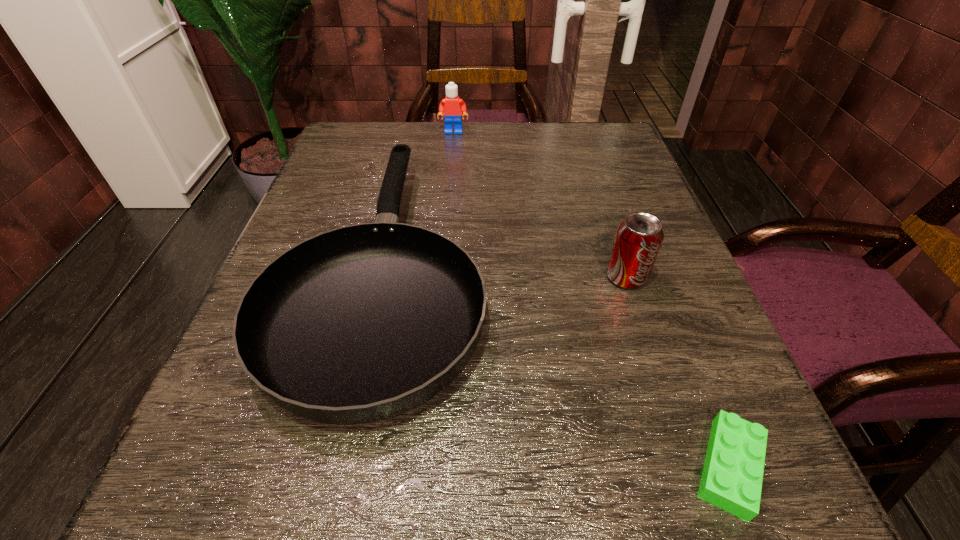
Where is `the taller Lego`? This screenshot has height=540, width=960. the taller Lego is located at coordinates (452, 106).

I want to click on the farther Lego, so click(452, 106).

The image size is (960, 540). Find the location of `soda can`. soda can is located at coordinates (638, 239).

At what (x,y) coordinates should I click in order to perform the action: click on the second shortest object. Please return your answer as a coordinate pair (x, y). Looking at the image, I should click on (365, 322).

This screenshot has width=960, height=540. I want to click on the shortest object, so click(x=732, y=475).

This screenshot has height=540, width=960. In order to click on the nearer Lego in this screenshot , I will do `click(732, 475)`.

This screenshot has width=960, height=540. What are the coordinates of `vacant space located 0.360m on the face of the left Lego` in the screenshot? It's located at (445, 228).

I want to click on vacant area situated 0.120m on the back of the soda can, so click(x=607, y=219).

At what (x,y) coordinates should I click in order to perform the action: click on vacant area situated 0.140m at the end of the handle of the frying pan. Please return your answer as a coordinate pair (x, y). The height and width of the screenshot is (540, 960). Looking at the image, I should click on (413, 141).

The height and width of the screenshot is (540, 960). In order to click on vacant space located at the end of the handle of the frying pan in this screenshot , I will do coord(414,135).